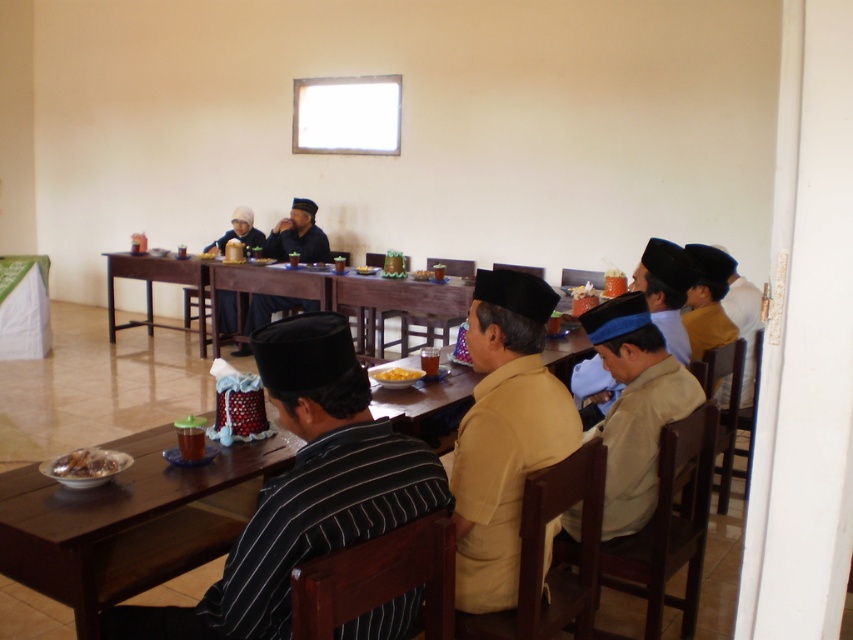
Can you confirm if blue felt hat at right is smaller than shiny metallic plate at lower left?

No.

Which of these two, blue felt hat at right or shiny metallic plate at lower left, stands shorter?

With less height is shiny metallic plate at lower left.

The height and width of the screenshot is (640, 853). What do you see at coordinates (665, 291) in the screenshot?
I see `blue felt hat at right` at bounding box center [665, 291].

This screenshot has height=640, width=853. Identify the location of blue felt hat at right. (665, 291).

Who is positioned more to the left, light brown uniform at center or matte black headscarf at center?

Positioned to the left is matte black headscarf at center.

Does point (624, 483) come in front of point (225, 321)?

Yes.

I want to click on light brown uniform at center, so click(635, 406).

Does blue felt hat at right have a greater width compared to brown wooden table at center?

Incorrect, blue felt hat at right's width does not surpass brown wooden table at center's.

Based on the photo, is blue felt hat at right closer to camera compared to brown wooden table at center?

Yes.

This screenshot has width=853, height=640. Describe the element at coordinates (665, 291) in the screenshot. I see `blue felt hat at right` at that location.

Locate an element on the screen. blue felt hat at right is located at coordinates coord(665,291).